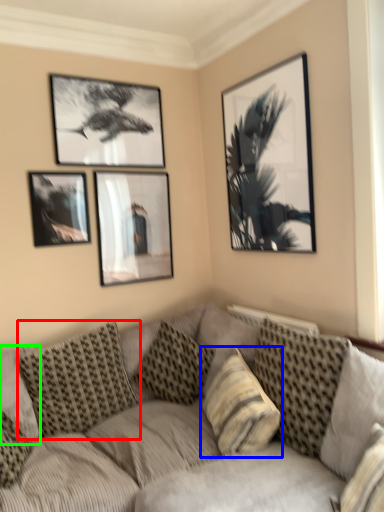
Question: Considering the real-world distances, which object is farthest from pillow (highlighted by a red box)? pillow (highlighted by a blue box) or pillow (highlighted by a green box)?

Choices:
 (A) pillow
 (B) pillow

Answer: (A)